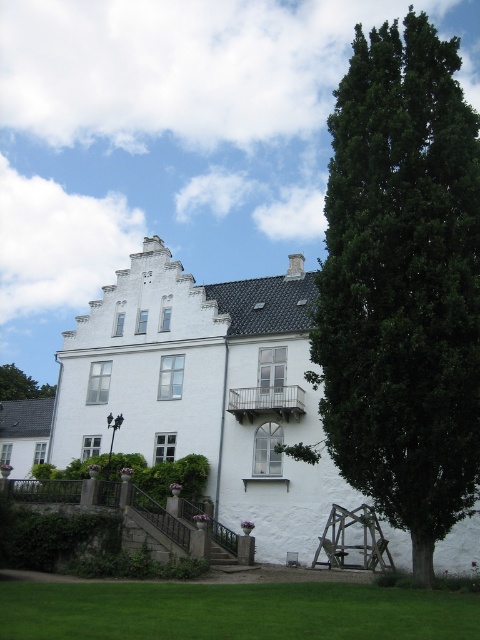
You are a gardener planning to plant a new tree in the garden of the building. You have two options for locations based on the existing trees. The first location is next to the green leafy tree at right, and the second is near the green leafy tree at upper left. Considering the space available, which location would allow for a wider tree to be planted?

The location next to the green leafy tree at right would allow for a wider tree to be planted since the existing green leafy tree at right is wider than the green leafy tree at upper left.

You are a gardener planning to water both the green leafy tree at right and the green grass at lower center. If your watering can holds enough water for 10 meters of travel, can you water both without needing to refill?

The green leafy tree at right and green grass at lower center are 17.31 meters apart from each other. Since the distance between them is greater than 10 meters, you would need to refill your watering can before watering both.

You are standing in front of the building and want to know which object is taller between the green grass at lower center and the green leafy tree at upper left. Can you tell me?

The green leafy tree at upper left is taller than the green grass at lower center.